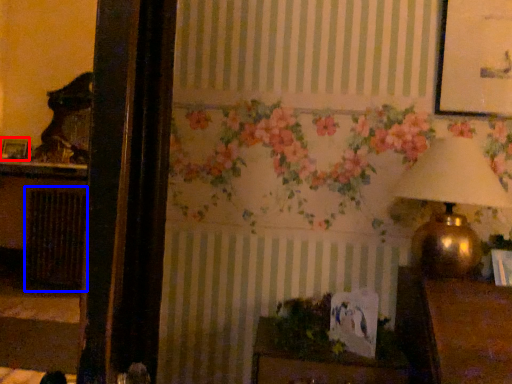
Question: Which of the following is the closest to the observer, picture frame (highlighted by a red box) or radiator (highlighted by a blue box)?

Choices:
 (A) picture frame
 (B) radiator

Answer: (B)